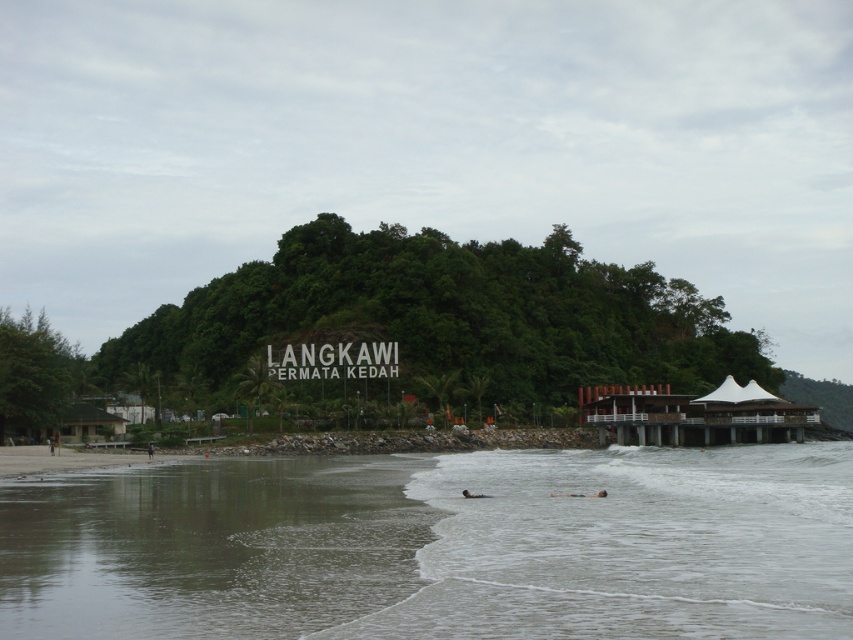
You are a swimmer wanting to cross from the clear water at lower left to the clear water at center. The safe distance for your swimming ability is up to 10 meters. Can you safely make the swim?

The clear water at center is 10.12 meters from the clear water at lower left. Since 10.12 meters exceeds your safe distance of 10 meters, you cannot safely make the swim.

You are planning to build a small dock for kayaking. You have two options for locations based on the clear water areas shown in the image. The first option is at the clear water at center, and the second is at the clear water at lower left. Which location would provide a deeper area for launching kayaks?

The clear water at center has a greater height compared to the clear water at lower left, so the clear water at center would provide a deeper area for launching kayaks.

You are standing on the beach and want to take a photo of the clear water at center. Where should you position yourself to capture it in the best way?

The clear water at center is located at point coordinates of approximately 0.853 on the x axis and 0.742 on the y axis. To capture it best, position yourself directly facing that coordinate point.